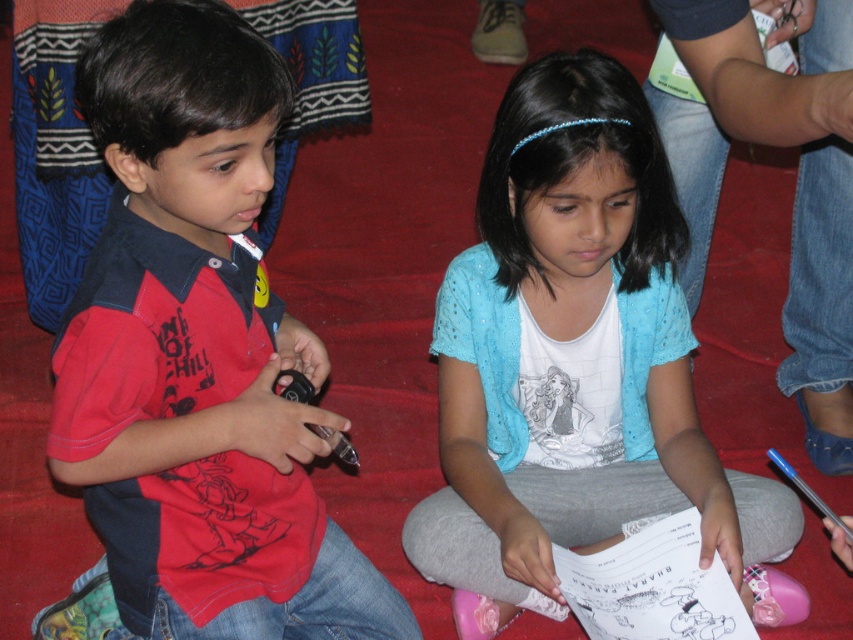
Question: Does red matte shirt at left have a greater width compared to blue cotton shirt at center?

Choices:
 (A) yes
 (B) no

Answer: (B)

Question: Which object is closer to the camera taking this photo?

Choices:
 (A) blue cotton shirt at center
 (B) red matte shirt at left

Answer: (B)

Question: Does red matte shirt at left appear under blue cotton shirt at center?

Choices:
 (A) yes
 (B) no

Answer: (B)

Question: Which object is closer to the camera taking this photo?

Choices:
 (A) blue cotton shirt at center
 (B) red matte shirt at left

Answer: (B)

Question: Observing the image, what is the correct spatial positioning of red matte shirt at left in reference to blue cotton shirt at center?

Choices:
 (A) above
 (B) below

Answer: (A)

Question: Which point appears farthest from the camera in this image?

Choices:
 (A) (119, 312)
 (B) (618, 433)

Answer: (B)